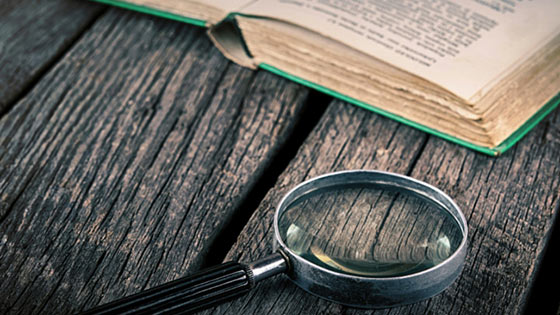
Where is `looking glass`? This screenshot has height=315, width=560. looking glass is located at coordinates (366, 242).